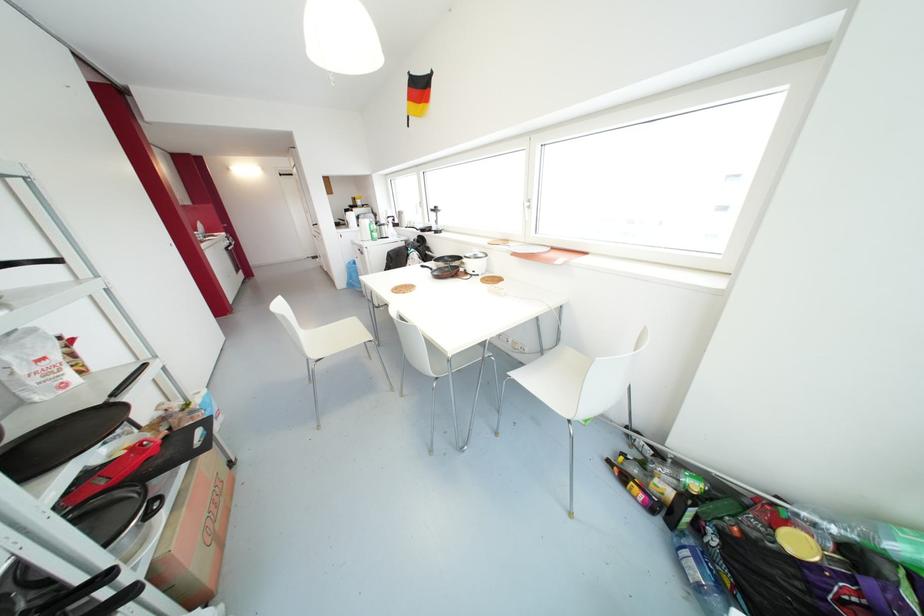
What do you see at coordinates (527, 204) in the screenshot?
I see `the silver cabinet handle` at bounding box center [527, 204].